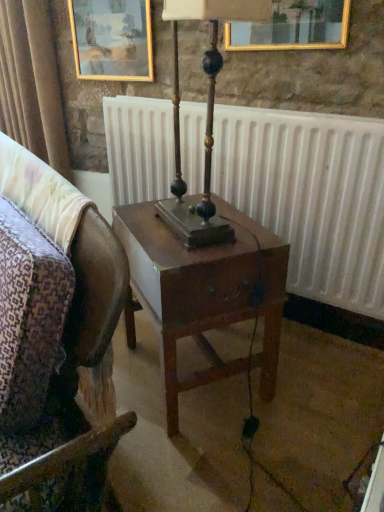
Locate an element on the screen. wooden polished table lamp at center is located at coordinates (206, 119).

What do you see at coordinates (49, 303) in the screenshot? I see `wooden chair at center` at bounding box center [49, 303].

Locate an element on the screen. wooden polished table lamp at center is located at coordinates (206, 119).

In the scene shown: Is gold-framed painting at upper left taller or shorter than wooden chair at center?

gold-framed painting at upper left is shorter than wooden chair at center.

How different are the orientations of gold-framed painting at upper left and wooden chair at center in degrees?

The facing directions of gold-framed painting at upper left and wooden chair at center are 23.4 degrees apart.

Which point is more distant from viewer, (x=87, y=57) or (x=34, y=399)?

The point (x=87, y=57) is farther.

Can wooden chair at center be found inside gold-framed painting at upper left?

No.

Could you tell me if wooden polished table lamp at center is facing velvet curtain at upper left?

No, wooden polished table lamp at center is not facing towards velvet curtain at upper left.

Is wooden polished table lamp at center spatially inside velvet curtain at upper left, or outside of it?

The correct answer is: outside.

Where is `bedside lamp that appears on the right of velvet curtain at upper left`? bedside lamp that appears on the right of velvet curtain at upper left is located at coordinates (206, 119).

Which is in front, wooden polished table lamp at center or velvet curtain at upper left?

wooden polished table lamp at center is more forward.

Considering the sizes of objects white matte radiator at center and velvet curtain at upper left in the image provided, who is bigger, white matte radiator at center or velvet curtain at upper left?

velvet curtain at upper left.

Identify the location of radiator on the right of velvet curtain at upper left. Image resolution: width=384 pixels, height=512 pixels. (310, 196).

Is white matte radiator at center wider than velvet curtain at upper left?

No, white matte radiator at center is not wider than velvet curtain at upper left.

Which of these two, white matte radiator at center or gold-framed painting at upper left, is thinner?

With smaller width is gold-framed painting at upper left.

From the image's perspective, is white matte radiator at center on top of gold-framed painting at upper left?

No, from the image's perspective, white matte radiator at center is not on top of gold-framed painting at upper left.

The height and width of the screenshot is (512, 384). I want to click on picture frame that is above the white matte radiator at center (from the image's perspective), so click(x=112, y=39).

Choose the correct answer: Is white matte radiator at center inside gold-framed painting at upper left or outside it?

white matte radiator at center exists outside the volume of gold-framed painting at upper left.

Does wooden polished table lamp at center have a smaller size compared to white matte radiator at center?

Correct, wooden polished table lamp at center occupies less space than white matte radiator at center.

Considering the positions of objects wooden polished table lamp at center and white matte radiator at center in the image provided, who is more to the left, wooden polished table lamp at center or white matte radiator at center?

From the viewer's perspective, wooden polished table lamp at center appears more on the left side.

From the image's perspective, is wooden polished table lamp at center above or below white matte radiator at center?

wooden polished table lamp at center is below white matte radiator at center.

Which object is positioned more to the right, velvet curtain at upper left or gold-framed painting at upper left?

Positioned to the right is gold-framed painting at upper left.

Do you think velvet curtain at upper left is within gold-framed painting at upper left, or outside of it?

velvet curtain at upper left is outside gold-framed painting at upper left.

From a real-world perspective, is velvet curtain at upper left above or below gold-framed painting at upper left?

velvet curtain at upper left is below gold-framed painting at upper left.

Between velvet curtain at upper left and gold-framed painting at upper left, which one has smaller size?

gold-framed painting at upper left.

Considering the positions of objects wooden chair at center and wooden polished table lamp at center in the image provided, who is more to the left, wooden chair at center or wooden polished table lamp at center?

wooden chair at center.

Which of these two, wooden chair at center or wooden polished table lamp at center, stands shorter?

wooden chair at center.

In the image, there is a wooden polished table lamp at center. Where is `chair below it (from a real-world perspective)`? chair below it (from a real-world perspective) is located at coordinates (49, 303).

Which object is thinner, wooden chair at center or wooden polished table lamp at center?

Thinner between the two is wooden polished table lamp at center.

Locate an element on the screen. This screenshot has height=512, width=384. picture frame that appears above the wooden chair at center (from a real-world perspective) is located at coordinates (112, 39).

I want to click on bedside lamp directly beneath the velvet curtain at upper left (from a real-world perspective), so click(x=206, y=119).

Considering their positions, is gold-framed painting at upper left positioned closer to velvet curtain at upper left than white matte radiator at center?

gold-framed painting at upper left is closer to velvet curtain at upper left.

Which object lies further to the anchor point gold-framed painting at upper left, velvet curtain at upper left or wooden polished table lamp at center?

Among the two, wooden polished table lamp at center is located further to gold-framed painting at upper left.

In the scene shown: When comparing their distances from velvet curtain at upper left, does white matte radiator at center or gold-framed painting at upper left seem closer?

gold-framed painting at upper left is closer to velvet curtain at upper left.

Which object lies nearer to the anchor point white matte radiator at center, gold-framed painting at upper left or velvet curtain at upper left?

The object closer to white matte radiator at center is gold-framed painting at upper left.

Looking at this image, based on their spatial positions, is gold-framed painting at upper left or velvet curtain at upper left closer to wooden polished table lamp at center?

Based on the image, gold-framed painting at upper left appears to be nearer to wooden polished table lamp at center.

From the image, which object appears to be farther from velvet curtain at upper left, wooden polished table lamp at center or white matte radiator at center?

Based on the image, wooden polished table lamp at center appears to be further to velvet curtain at upper left.

Looking at the image, which one is located closer to velvet curtain at upper left, gold-framed painting at upper left or wooden polished table lamp at center?

Based on the image, gold-framed painting at upper left appears to be nearer to velvet curtain at upper left.

When comparing their distances from white matte radiator at center, does wooden chair at center or velvet curtain at upper left seem further?

The object further to white matte radiator at center is wooden chair at center.

Locate an element on the screen. bedside lamp between velvet curtain at upper left and white matte radiator at center from left to right is located at coordinates (206, 119).

The width and height of the screenshot is (384, 512). In order to click on bedside lamp located between wooden chair at center and white matte radiator at center in the left-right direction in this screenshot , I will do `click(206, 119)`.

In order to click on radiator between wooden chair at center and velvet curtain at upper left in the front-back direction in this screenshot , I will do `click(310, 196)`.

The width and height of the screenshot is (384, 512). I want to click on bedside lamp between wooden chair at center and velvet curtain at upper left from front to back, so coord(206,119).